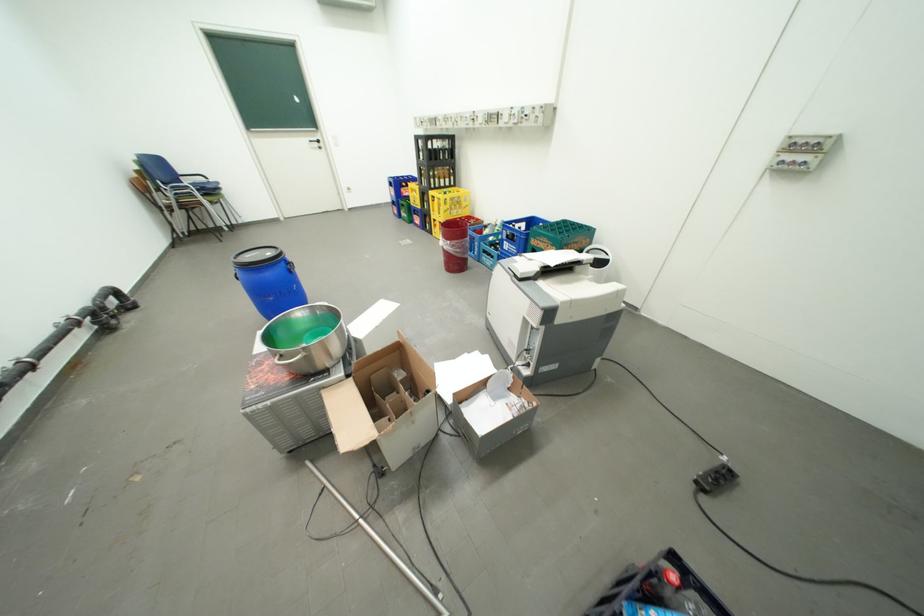
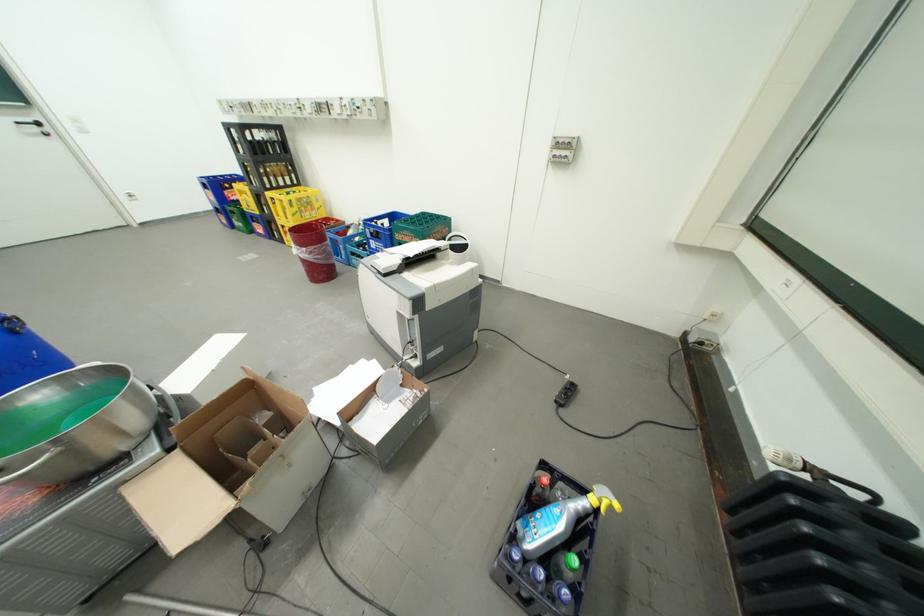
In the second image, find the point that corresponds to the point at 562,246 in the first image.

(424, 238)